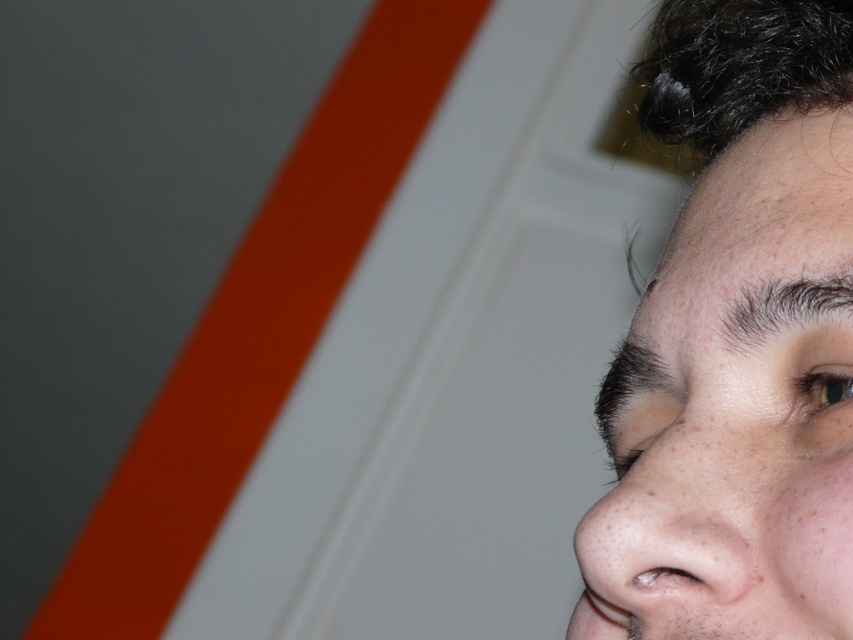
You are a photographer trying to capture a portrait. You notice the smooth skin face at upper right and the dark brown hair at upper right in your frame. Which one of these two elements takes up more space in the current composition?

The smooth skin face at upper right takes up more space in the current composition because it is bigger than the dark brown hair at upper right according to the description.

You are a photographer adjusting the focus on your camera. The subject has a smooth skin face at upper right and dark brown hair at upper right. Can you focus on both simultaneously if your camera has a depth of field that can only handle objects within 1.5 inches of each other?

The smooth skin face at upper right is 1.74 inches away from the dark brown hair at upper right. Since the distance between them exceeds the camera depth of field limit of 1.5 inches, you cannot focus on both simultaneously.